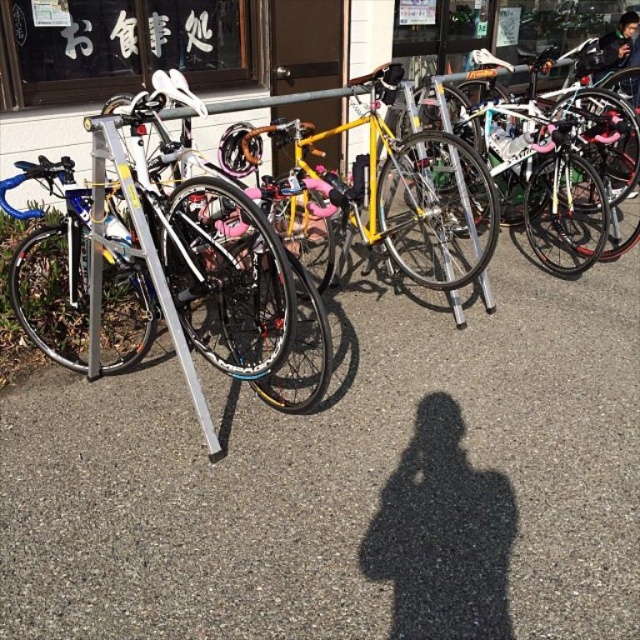
Question: Does shiny silver bicycle at center have a larger size compared to yellow matte bicycle at center?

Choices:
 (A) no
 (B) yes

Answer: (A)

Question: Can you confirm if matte asphalt pavement at center is positioned below shiny silver bicycle at center?

Choices:
 (A) no
 (B) yes

Answer: (B)

Question: Which of the following is the farthest from the observer?

Choices:
 (A) (440, 131)
 (B) (129, 305)

Answer: (B)

Question: Which point is farther to the camera?

Choices:
 (A) matte asphalt pavement at center
 (B) yellow matte bicycle at center

Answer: (B)

Question: Which of the following is the farthest from the observer?

Choices:
 (A) yellow matte bicycle at center
 (B) shiny silver bicycle at center

Answer: (A)

Question: Is shiny silver bicycle at center wider than yellow matte bicycle at center?

Choices:
 (A) no
 (B) yes

Answer: (A)